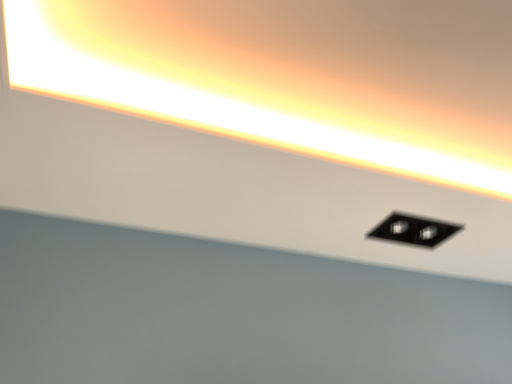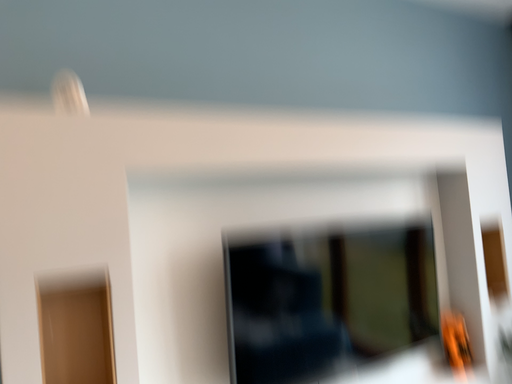
Question: How did the camera likely rotate when shooting the video?

Choices:
 (A) rotated upward
 (B) rotated downward

Answer: (B)